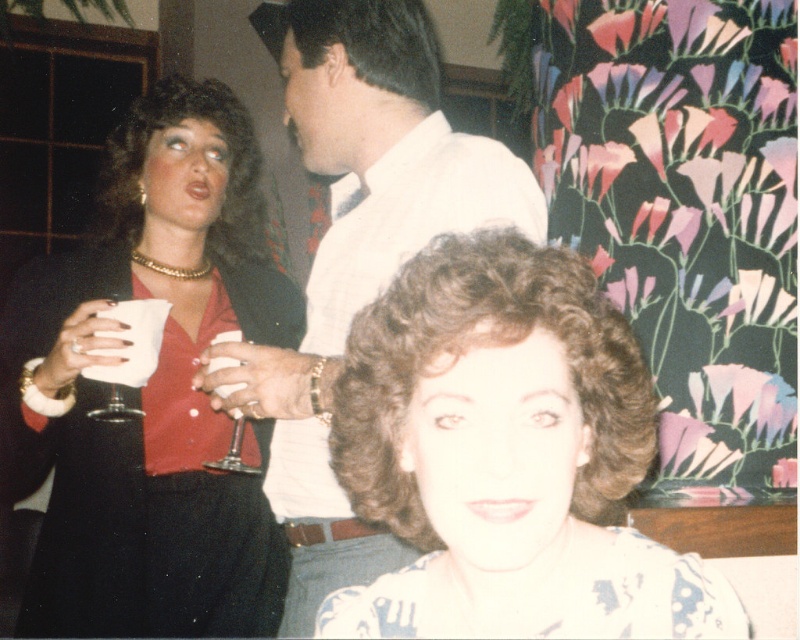
Is point (440, 632) less distant than point (162, 406)?

Yes, it is in front of point (162, 406).

Does floral print blouse at center have a smaller size compared to matte black dress at upper left?

Yes.

This screenshot has height=640, width=800. What do you see at coordinates (506, 456) in the screenshot?
I see `floral print blouse at center` at bounding box center [506, 456].

Locate an element on the screen. This screenshot has width=800, height=640. floral print blouse at center is located at coordinates (506, 456).

Is floral print blouse at center further to the viewer compared to clear glass wine glass at center?

No, floral print blouse at center is closer to the viewer.

From the picture: Is floral print blouse at center smaller than clear glass wine glass at center?

Incorrect, floral print blouse at center is not smaller in size than clear glass wine glass at center.

Which is in front, point (374, 436) or point (233, 452)?

Point (374, 436)

Where is `floral print blouse at center`? The height and width of the screenshot is (640, 800). floral print blouse at center is located at coordinates (506, 456).

Between clear glass wine glass at center and clear glass wine glass at left, which one is positioned lower?

clear glass wine glass at center is lower down.

Is point (229, 337) behind point (114, 387)?

Yes, it is behind point (114, 387).

Find the location of a particular element. The image size is (800, 640). clear glass wine glass at center is located at coordinates (234, 451).

Find the location of a particular element. The height and width of the screenshot is (640, 800). clear glass wine glass at center is located at coordinates (234, 451).